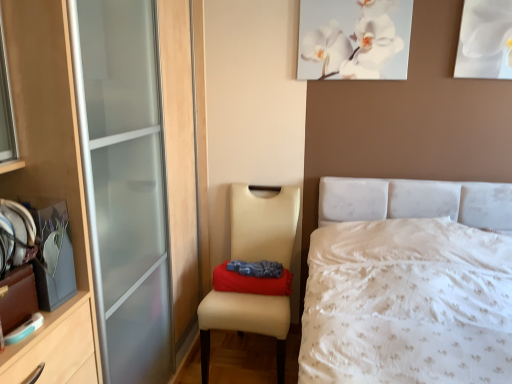
Image resolution: width=512 pixels, height=384 pixels. In order to click on free space above red fabric pillow at center (from a real-world perspective) in this screenshot , I will do `click(255, 270)`.